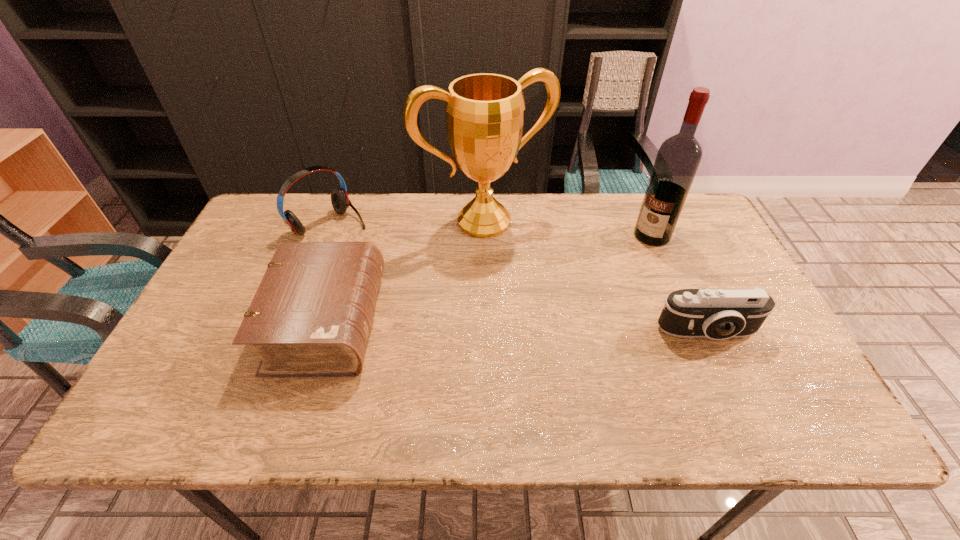
Identify the location of free space on the desktop that is between the Bible and the camera and is positioned with the microphone attached to the side of the third tallest object. pos(463,327).

Where is `free space on the desktop that is between the Bible and the camera and is positioned on the front-facing side of the third object from right to left`? The image size is (960, 540). free space on the desktop that is between the Bible and the camera and is positioned on the front-facing side of the third object from right to left is located at coordinates (556, 329).

I want to click on free spot on the desktop that is between the Bible and the camera and is positioned on the front and back of the alcohol, so click(568, 329).